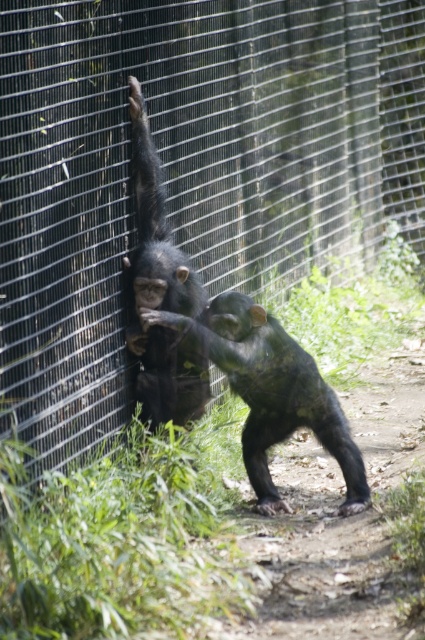
You are a zookeeper observing two chimpanzees in their enclosure. You notice two specific points marked in the image. The first point is at coordinates point (280, 378), and the second point is at coordinates point (152, 328). From your vantage point, which point is closer to you?

Point (280, 378) is in front of point (152, 328), so it is closer to you.

Consider the image. You are a zookeeper observing the chimpanzees in their enclosure. You notice a specific point marked at coordinates point (269, 390). Which chimpanzee is this point located on?

The point (269, 390) is located on the dark brown fur monkey at center.

You are a zookeeper observing the chimpanzees in their enclosure. You notice the dark brown fur monkey at center and the shiny black monkey at left. Which monkey has a larger body size?

The dark brown fur monkey at center might be wider than shiny black monkey at left, so it possibly has a larger body size.